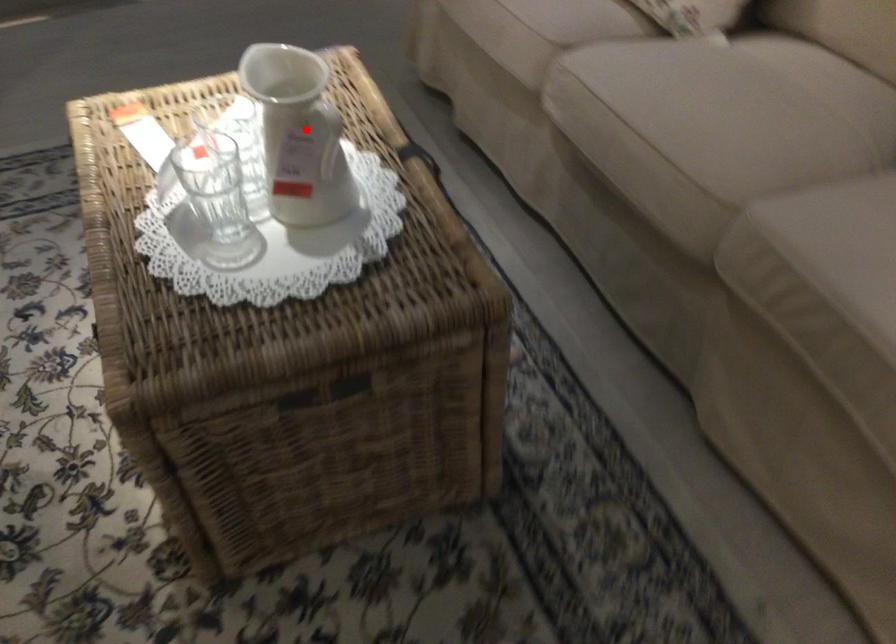
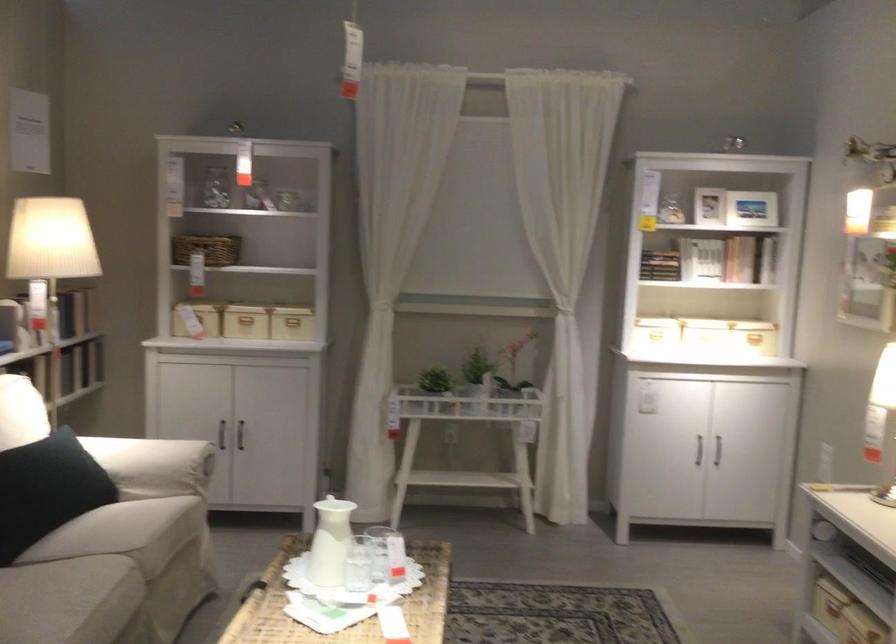
Find the pixel in the second image that matches the highlighted location in the first image.

(330, 542)